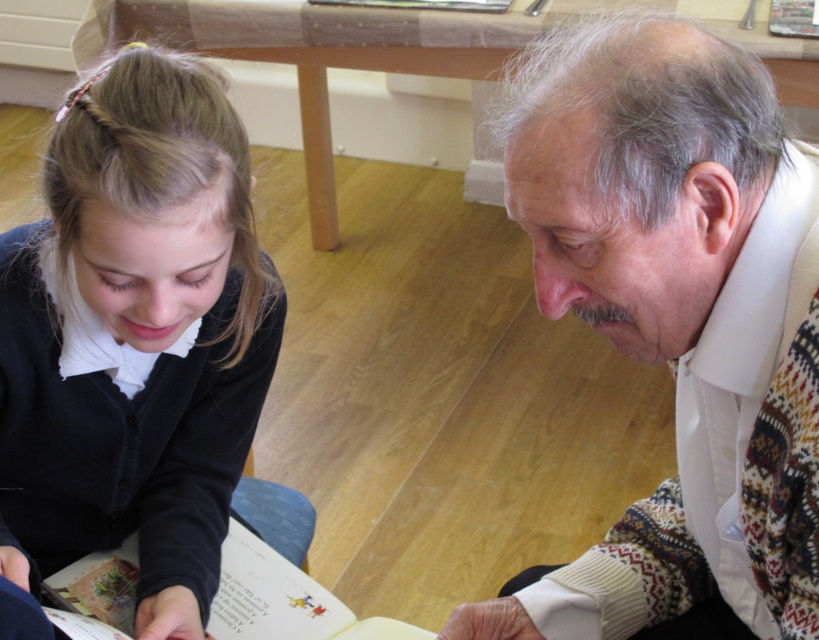
Question: Among these objects, which one is farthest from the camera?

Choices:
 (A) white textured sweater at center
 (B) black matte sweater at lower left

Answer: (B)

Question: Is black matte sweater at lower left below paper book at lower left?

Choices:
 (A) yes
 (B) no

Answer: (B)

Question: Which point appears closest to the camera in this image?

Choices:
 (A) (252, 637)
 (B) (106, 424)
 (C) (726, 276)

Answer: (C)

Question: Which object is positioned closest to the black matte sweater at lower left?

Choices:
 (A) paper book at lower left
 (B) white textured sweater at center

Answer: (A)

Question: Does black matte sweater at lower left come behind paper book at lower left?

Choices:
 (A) yes
 (B) no

Answer: (B)

Question: Does black matte sweater at lower left appear on the right side of paper book at lower left?

Choices:
 (A) no
 (B) yes

Answer: (A)